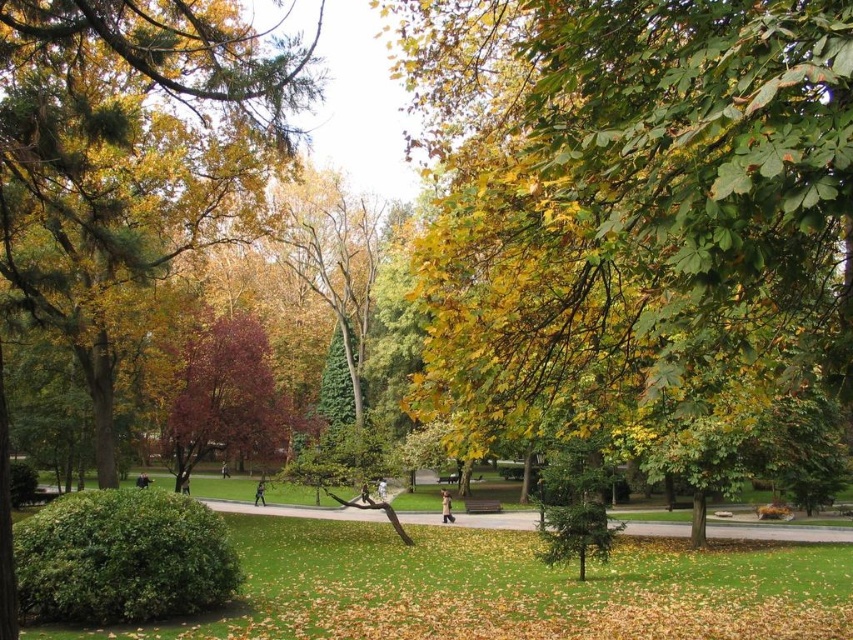
Question: Considering the real-world distances, which object is closest to the green glossy tree at upper left?

Choices:
 (A) purple glossy tree at center
 (B) green leafy tree at center

Answer: (A)

Question: Estimate the real-world distances between objects in this image. Which object is farther from the green leafy tree at center?

Choices:
 (A) green glossy tree at upper left
 (B) purple glossy tree at center

Answer: (B)

Question: Can you confirm if green leafy tree at center is positioned above green glossy tree at upper left?

Choices:
 (A) no
 (B) yes

Answer: (A)

Question: Does green glossy tree at upper left have a larger size compared to purple glossy tree at center?

Choices:
 (A) no
 (B) yes

Answer: (B)

Question: Which point is farther from the camera taking this photo?

Choices:
 (A) (128, 189)
 (B) (775, 19)
 (C) (268, 448)

Answer: (C)

Question: Where is green leafy tree at center located in relation to purple glossy tree at center in the image?

Choices:
 (A) above
 (B) below

Answer: (A)